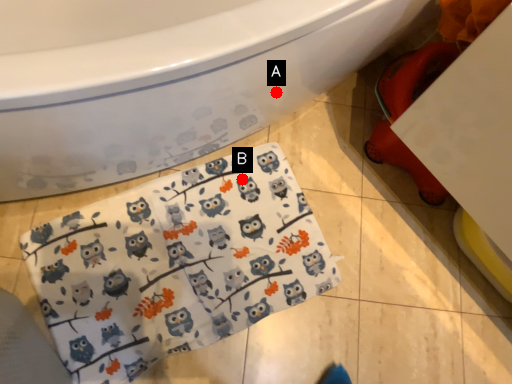
Question: Two points are circled on the image, labeled by A and B beside each circle. Which point is closer to the camera?

Choices:
 (A) A is closer
 (B) B is closer

Answer: (A)